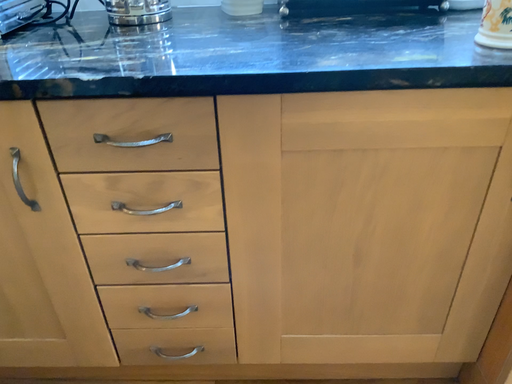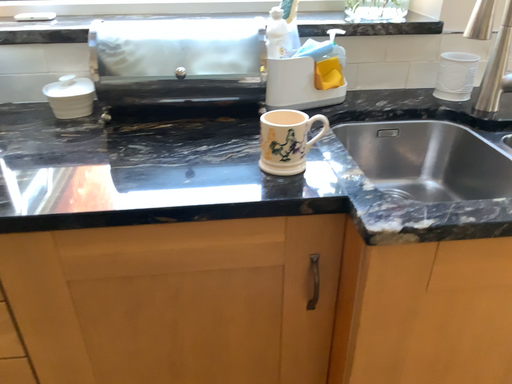
Question: How did the camera likely rotate when shooting the video?

Choices:
 (A) rotated left
 (B) rotated right

Answer: (B)